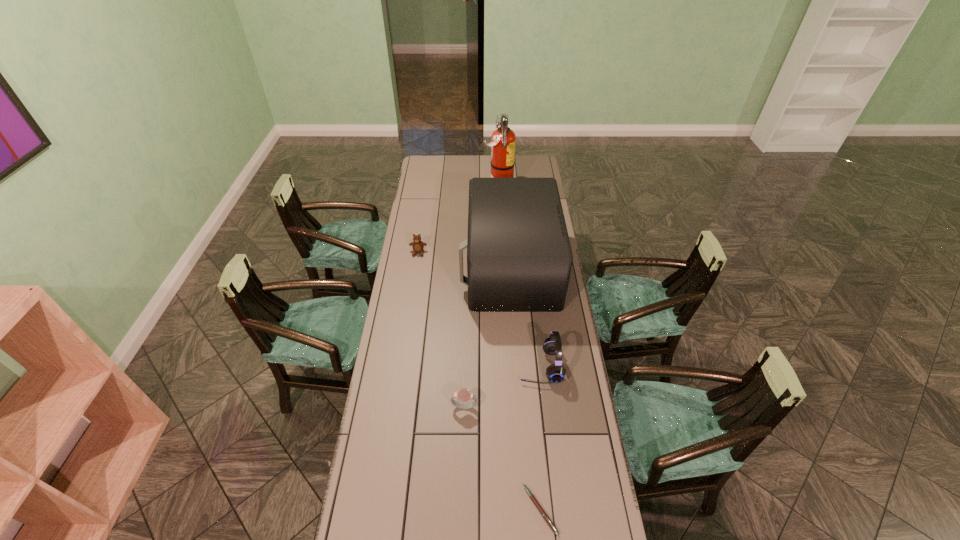
Where is `object that is the nearest to the fifth shortest object`? The height and width of the screenshot is (540, 960). object that is the nearest to the fifth shortest object is located at coordinates (418, 246).

Point out which object is positioned as the fourth nearest to the fire extinguisher. Please provide its 2D coordinates. Your answer should be formatted as a tuple, i.e. [(x, y)], where the tuple contains the x and y coordinates of a point satisfying the conditions above.

[(463, 395)]